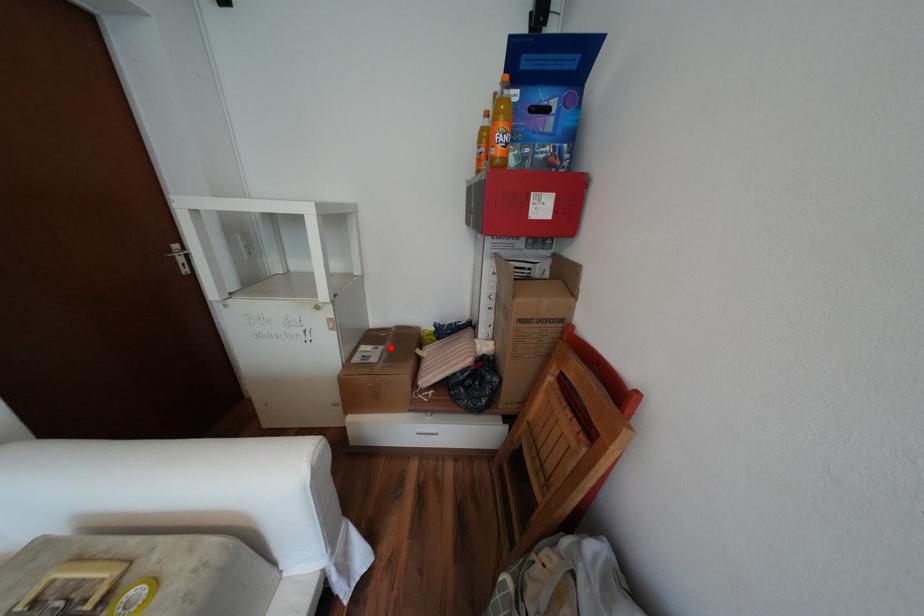
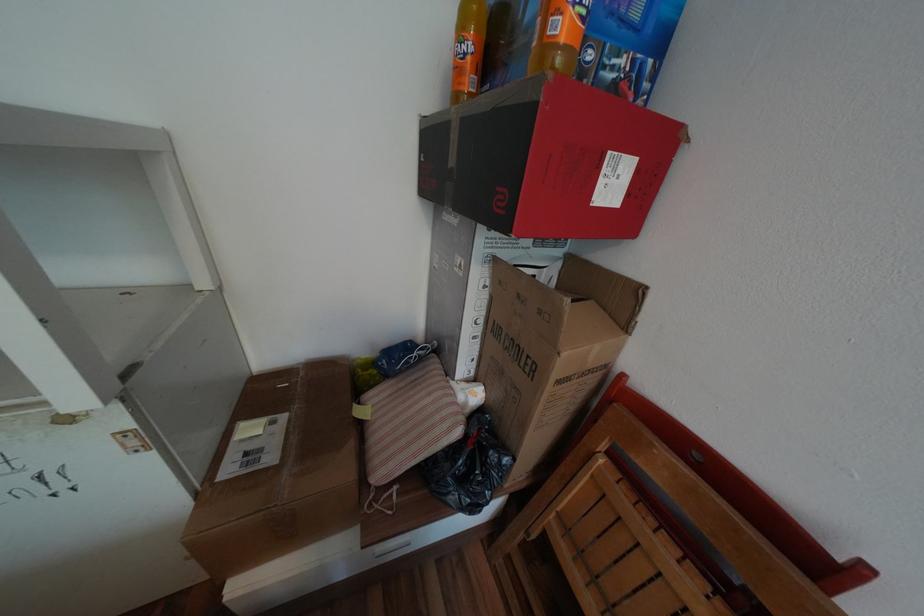
Question: A red point is marked in image1. In image2, is the corresponding 3D point closer to the camera or farther? Reply with the corresponding letter.

Choices:
 (A) The corresponding 3D point is closer.
 (B) The corresponding 3D point is farther.

Answer: (B)